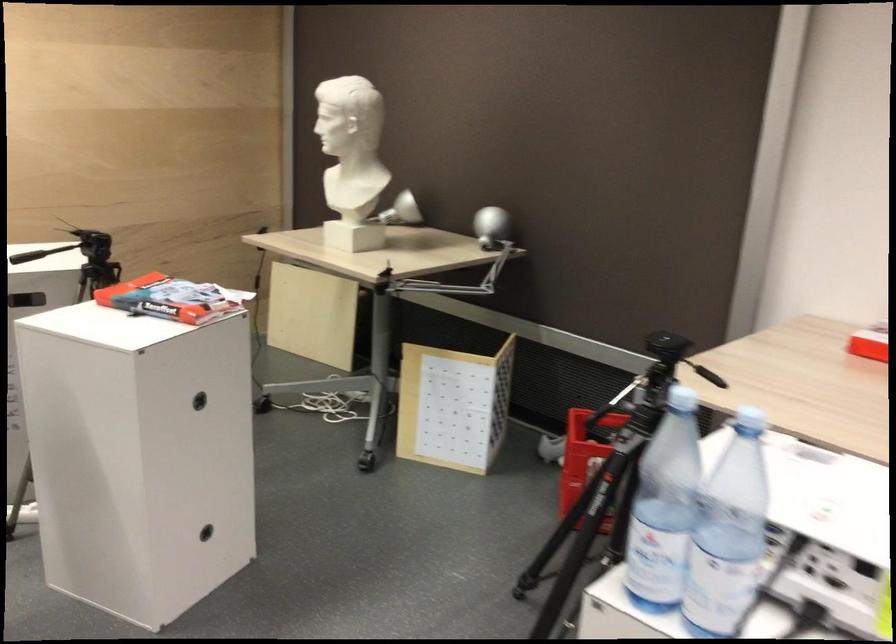
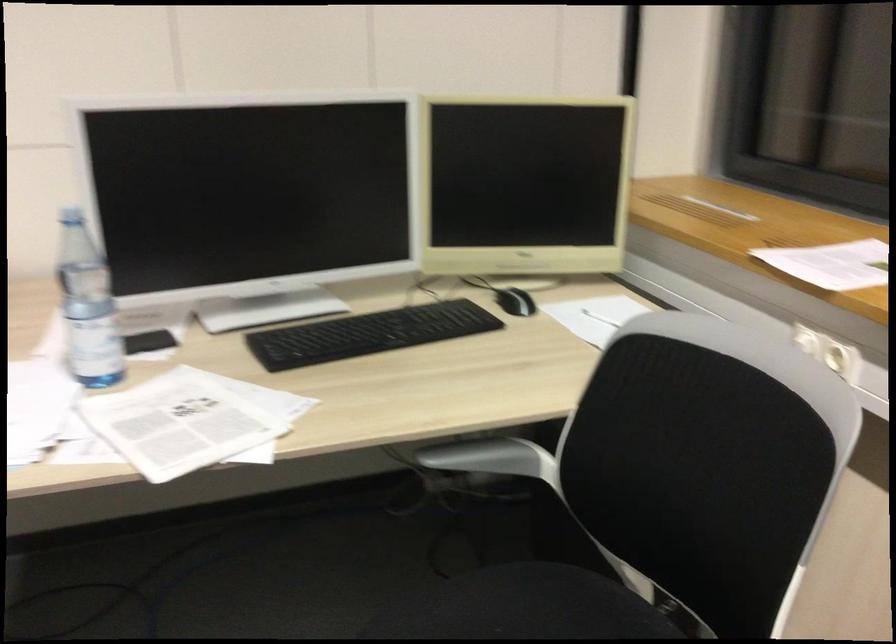
Question: Based on the continuous images, in which direction is the camera rotating? Reply with the corresponding letter.

Choices:
 (A) Left
 (B) Right
 (C) Up
 (D) Down

Answer: (B)